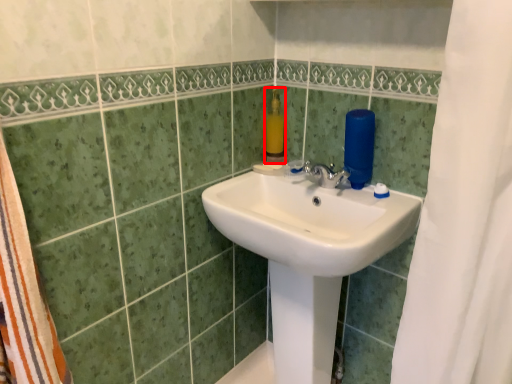
Question: From the image's perspective, where is soap dispenser (annotated by the red box) located in relation to sink in the image?

Choices:
 (A) below
 (B) above

Answer: (B)